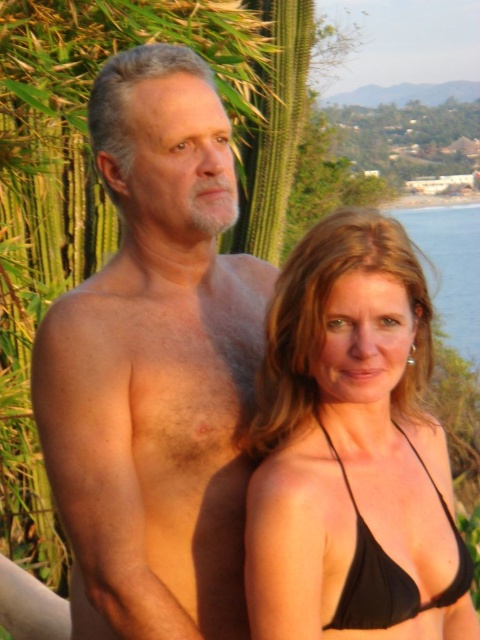
Question: Which point appears closest to the camera in this image?

Choices:
 (A) (179, 424)
 (B) (441, 317)

Answer: (A)

Question: Is smooth skin torso at center bigger than black matte bikini top at center?

Choices:
 (A) yes
 (B) no

Answer: (A)

Question: Can you confirm if black bikini top at center is positioned to the right of blue water at right?

Choices:
 (A) no
 (B) yes

Answer: (A)

Question: Which of the following is the closest to the observer?

Choices:
 (A) blue water at right
 (B) black bikini top at center
 (C) black matte bikini top at center

Answer: (B)

Question: Does smooth skin torso at center have a smaller size compared to black bikini top at center?

Choices:
 (A) no
 (B) yes

Answer: (A)

Question: Which point is farther to the camera?

Choices:
 (A) (417, 228)
 (B) (448, 602)

Answer: (A)